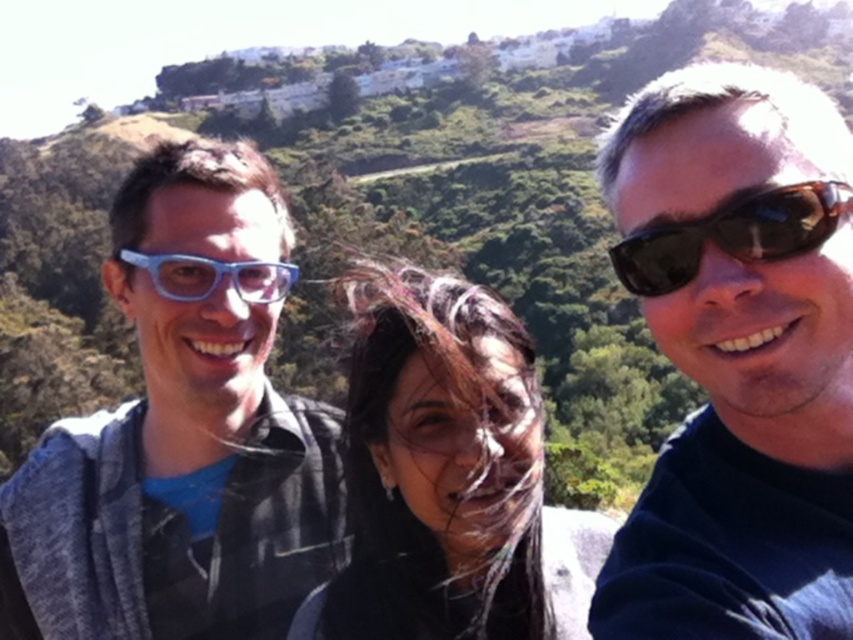
Is dark brown hair at center below blue plastic glasses at left?

Yes.

You are a GUI agent. You are given a task and a screenshot of the screen. Output one action in this format:
    pyautogui.click(x=<x>, y=<y>)
    Task: Click on the dark brown hair at center
    This screenshot has width=853, height=640.
    Given the screenshot: What is the action you would take?
    (x=445, y=474)

Is point (488, 568) more distant than point (200, 285)?

No, it is not.

The width and height of the screenshot is (853, 640). What are the coordinates of `dark brown hair at center` in the screenshot? It's located at (445, 474).

The width and height of the screenshot is (853, 640). What do you see at coordinates (445, 474) in the screenshot?
I see `dark brown hair at center` at bounding box center [445, 474].

Is point (467, 356) closer to camera compared to point (798, 192)?

That is False.

Where is `dark brown hair at center`? dark brown hair at center is located at coordinates (445, 474).

Between black plastic sunglasses at upper right and blue plastic glasses at left, which one is positioned lower?

black plastic sunglasses at upper right is below.

Who is more forward, (699,262) or (291,269)?

Point (699,262)

Image resolution: width=853 pixels, height=640 pixels. I want to click on black plastic sunglasses at upper right, so click(738, 356).